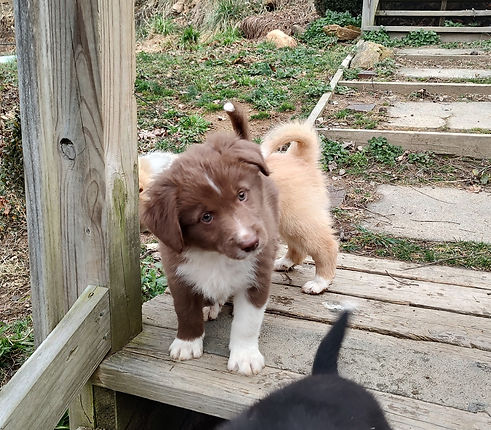
Find the location of a particular element. This screenshot has height=430, width=491. wood post is located at coordinates (97, 156).